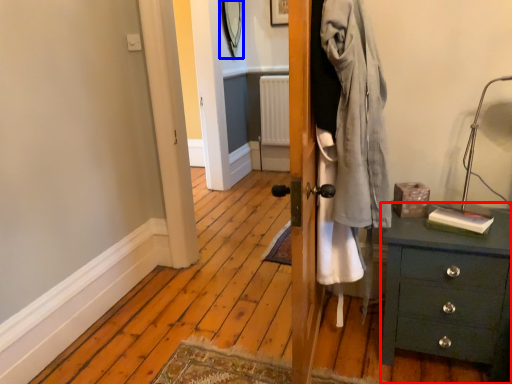
Question: Which object appears closest to the camera in this image, chest of drawers (highlighted by a red box) or mirror (highlighted by a blue box)?

Choices:
 (A) chest of drawers
 (B) mirror

Answer: (A)